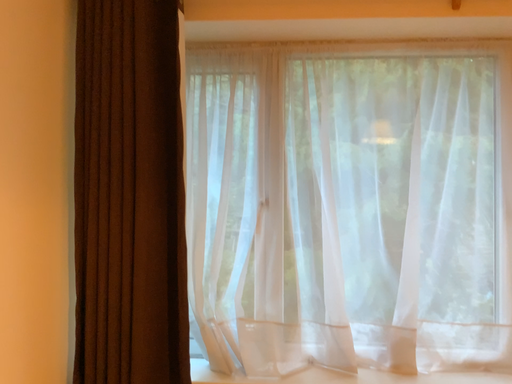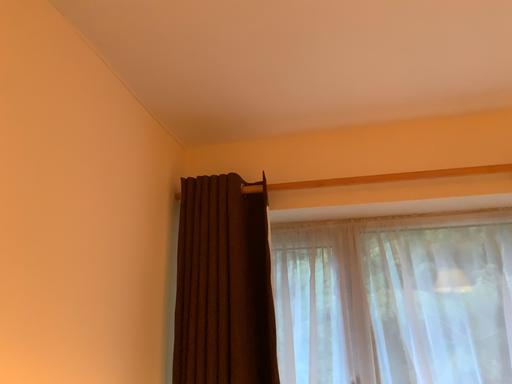
Question: Which way did the camera rotate in the video?

Choices:
 (A) rotated left
 (B) rotated right

Answer: (A)